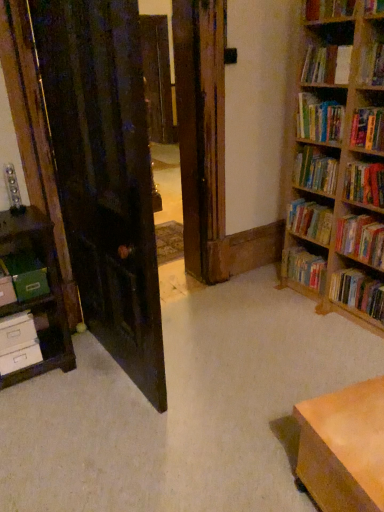
Where is `vacant area that lies in front of dark wood door at left`? vacant area that lies in front of dark wood door at left is located at coordinates (109, 438).